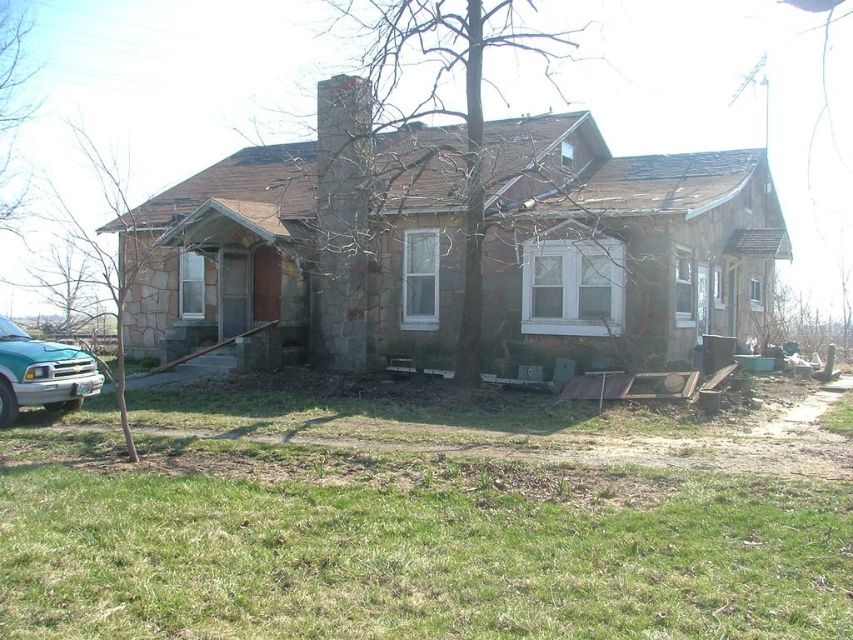
You are standing in front of the house and want to walk towards the teal metallic truck at lower left. Which direction should you move relative to the green grass at lower center?

Since the green grass at lower center is closer to the viewer than the teal metallic truck at lower left, you should move away from the green grass at lower center to reach the teal metallic truck at lower left.

You are standing on the green grass at lower center and want to see the teal metallic truck at lower left. Can you see the entire truck without any obstruction?

The green grass at lower center has a lesser height compared to teal metallic truck at lower left, so yes, you can see the entire teal metallic truck at lower left without any obstruction from the grass.

You are a gardener who needs to mow the lawn. You see the green grass at lower center and the teal metallic truck at lower left in the scene. Which area should you prioritize mowing first based on their sizes?

The green grass at lower center should be prioritized for mowing first because it has a larger size compared to the teal metallic truck at lower left, indicating a bigger area that requires attention.